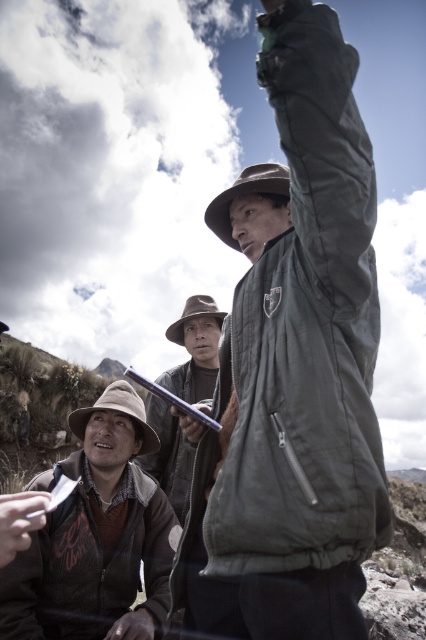
The image size is (426, 640). Find the location of `brown felt cowboy hat at lower left`. brown felt cowboy hat at lower left is located at coordinates (118, 412).

Does brown felt cowboy hat at lower left have a lesser width compared to dark brown leather hand at lower left?

No, brown felt cowboy hat at lower left is not thinner than dark brown leather hand at lower left.

Does point (80, 438) lie in front of point (152, 632)?

No, (80, 438) is further to viewer.

Identify the location of brown felt cowboy hat at lower left. This screenshot has width=426, height=640. (118, 412).

Does green matte jacket at center have a greater height compared to brown felt hat at center?

Yes.

What do you see at coordinates (293, 365) in the screenshot?
I see `green matte jacket at center` at bounding box center [293, 365].

Find the location of a particular element. The width and height of the screenshot is (426, 640). green matte jacket at center is located at coordinates (293, 365).

This screenshot has height=640, width=426. Identify the location of green matte jacket at center. (293, 365).

Is point (77, 612) more distant than point (135, 410)?

No, (77, 612) is closer to viewer.

Can you confirm if brown suede hat at lower left is bigger than brown felt cowboy hat at lower left?

Yes.

The width and height of the screenshot is (426, 640). I want to click on brown suede hat at lower left, so click(94, 532).